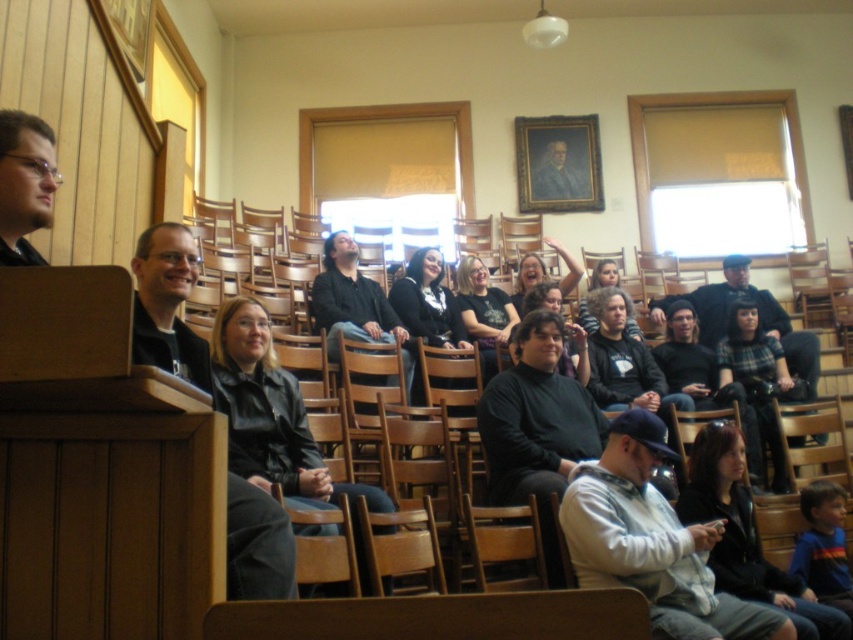
You are a photographer taking a picture of the dark gray knit sweater at center and the dark brown hair at center. To frame them both in the shot, should you adjust your camera to the left or right side?

The dark gray knit sweater at center is to the right of dark brown hair at center, so to frame both in the shot, you should adjust your camera to the left side to include the dark gray knit sweater at center which is on the right side of the dark brown hair at center.

You are a photographer taking a picture of the black leather jacket at center and the plaid wool sweater at center. Which one should you move to the right to have them both centered in your frame?

You should move the black leather jacket at center to the right since it is currently on the left side of the plaid wool sweater at center, so shifting it right would help center both items in the frame.